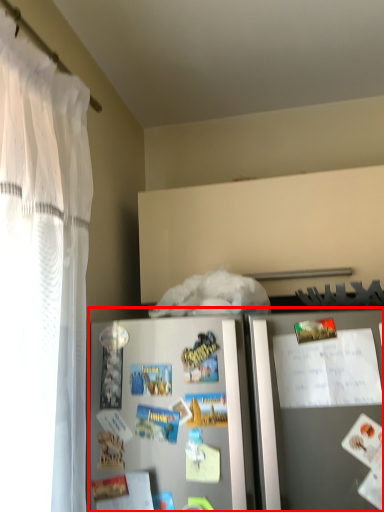
Question: In this image, where is refrigerator (annotated by the red box) located relative to comic book?

Choices:
 (A) left
 (B) right

Answer: (A)